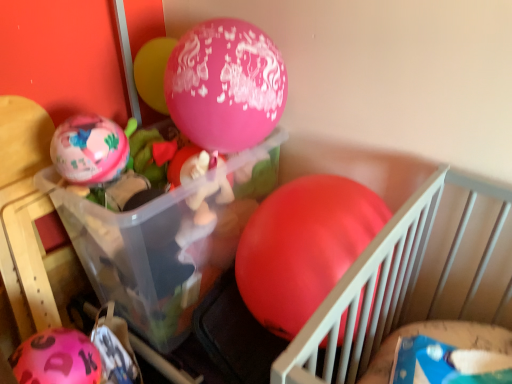
This screenshot has height=384, width=512. Describe the element at coordinates (57, 358) in the screenshot. I see `pink matte balloon at lower left, the fourth balloon from the right` at that location.

You are a GUI agent. You are given a task and a screenshot of the screen. Output one action in this format:
    pyautogui.click(x=<x>, y=<y>)
    Task: Click on the pink matte balloon at lower left, the fourth balloon from the right
    The image size is (512, 384).
    Given the screenshot: What is the action you would take?
    pyautogui.click(x=57, y=358)

Measure the distance between point (113, 232) and camera.

The depth of point (113, 232) is 38.35 inches.

What do you see at coordinates (167, 239) in the screenshot?
I see `transparent plastic container at center` at bounding box center [167, 239].

The height and width of the screenshot is (384, 512). In order to click on pink matte balloon at lower left, the fourth balloon from the right in this screenshot , I will do `click(57, 358)`.

Is transparent plastic container at center bigger than rubber matte balloon at center, positioned as the 4th balloon in left-to-right order?

Yes, transparent plastic container at center is bigger than rubber matte balloon at center, positioned as the 4th balloon in left-to-right order.

From a real-world perspective, which is physically above, transparent plastic container at center or rubber matte balloon at center, positioned as the 4th balloon in left-to-right order?

From a 3D spatial view, rubber matte balloon at center, positioned as the 4th balloon in left-to-right order, is above.

Is transparent plastic container at center not inside rubber matte balloon at center, which is the first balloon in right-to-left order?

That's correct, transparent plastic container at center is outside of rubber matte balloon at center, which is the first balloon in right-to-left order.

Is transparent plastic container at center far away from rubber matte balloon at center, positioned as the 4th balloon in left-to-right order?

transparent plastic container at center is near rubber matte balloon at center, positioned as the 4th balloon in left-to-right order, not far away.

Would you say rubber matte balloon at center, positioned as the 4th balloon in left-to-right order, is inside or outside pink glossy balloon at upper center, marked as the third balloon in a left-to-right arrangement?

rubber matte balloon at center, positioned as the 4th balloon in left-to-right order, is not inside pink glossy balloon at upper center, marked as the third balloon in a left-to-right arrangement, it's outside.

Is the depth of rubber matte balloon at center, positioned as the 4th balloon in left-to-right order, greater than that of pink glossy balloon at upper center, the 2th balloon in the right-to-left sequence?

No, it is in front of pink glossy balloon at upper center, the 2th balloon in the right-to-left sequence.

Which of these two, rubber matte balloon at center, positioned as the 4th balloon in left-to-right order, or pink glossy balloon at upper center, marked as the third balloon in a left-to-right arrangement, is thinner?

With smaller width is pink glossy balloon at upper center, marked as the third balloon in a left-to-right arrangement.

Does point (317, 262) come farther from viewer compared to point (150, 87)?

No, (317, 262) is in front of (150, 87).

Can you tell me how much pink glossy balloon at upper center, marked as the third balloon in a left-to-right arrangement, and matte pink balloon at left, placed as the second balloon when sorted from left to right, differ in facing direction?

They differ by 18.8 degrees in their facing directions.

Is pink glossy balloon at upper center, the 2th balloon in the right-to-left sequence, taller than matte pink balloon at left, placed as the second balloon when sorted from left to right?

Indeed, pink glossy balloon at upper center, the 2th balloon in the right-to-left sequence, has a greater height compared to matte pink balloon at left, placed as the second balloon when sorted from left to right.

Measure the distance from pink glossy balloon at upper center, the 2th balloon in the right-to-left sequence, to matte pink balloon at left, which is the third balloon from right to left.

They are 10.51 inches apart.

Would you say pink glossy balloon at upper center, the 2th balloon in the right-to-left sequence, is outside matte pink balloon at left, placed as the second balloon when sorted from left to right?

Yes, pink glossy balloon at upper center, the 2th balloon in the right-to-left sequence, is not within matte pink balloon at left, placed as the second balloon when sorted from left to right.

From a real-world perspective, is pink glossy balloon at upper center, the 2th balloon in the right-to-left sequence, above or below pink matte balloon at lower left, the 1th balloon positioned from the left?

pink glossy balloon at upper center, the 2th balloon in the right-to-left sequence, is situated higher than pink matte balloon at lower left, the 1th balloon positioned from the left, in the real world.

Between pink glossy balloon at upper center, marked as the third balloon in a left-to-right arrangement, and pink matte balloon at lower left, the 1th balloon positioned from the left, which one is positioned in front?

pink matte balloon at lower left, the 1th balloon positioned from the left, is more forward.

What are the coordinates of `balloon that is the 2nd object located in front of the pink glossy balloon at upper center, the 2th balloon in the right-to-left sequence` in the screenshot? It's located at (57, 358).

Does point (288, 256) come in front of point (58, 149)?

Yes, point (288, 256) is closer to viewer.

Is rubber matte balloon at center, positioned as the 4th balloon in left-to-right order, positioned with its back to matte pink balloon at left, which is the third balloon from right to left?

No, rubber matte balloon at center, positioned as the 4th balloon in left-to-right order, is not facing away from matte pink balloon at left, which is the third balloon from right to left.

From a real-world perspective, which object rests below the other?

rubber matte balloon at center, positioned as the 4th balloon in left-to-right order, is physically lower.

Is the position of rubber matte balloon at center, which is the first balloon in right-to-left order, less distant than that of matte pink balloon at left, placed as the second balloon when sorted from left to right?

Yes, rubber matte balloon at center, which is the first balloon in right-to-left order, is closer to the viewer.

Is point (99, 172) closer or farther from the camera than point (163, 50)?

Clearly, point (99, 172) is closer to the camera than point (163, 50).

From the image's perspective, which is above, matte pink balloon at left, placed as the second balloon when sorted from left to right, or pink glossy balloon at upper center, marked as the third balloon in a left-to-right arrangement?

Answer: From the image's view, pink glossy balloon at upper center, marked as the third balloon in a left-to-right arrangement, is above.

Would you say matte pink balloon at left, placed as the second balloon when sorted from left to right, is a long distance from pink glossy balloon at upper center, marked as the third balloon in a left-to-right arrangement?

No, matte pink balloon at left, placed as the second balloon when sorted from left to right, is not far from pink glossy balloon at upper center, marked as the third balloon in a left-to-right arrangement.

How many degrees apart are the facing directions of matte pink balloon at left, which is the third balloon from right to left, and pink glossy balloon at upper center, marked as the third balloon in a left-to-right arrangement?

There is a 18.8-degree angle between the facing directions of matte pink balloon at left, which is the third balloon from right to left, and pink glossy balloon at upper center, marked as the third balloon in a left-to-right arrangement.

Is pink glossy balloon at upper center, the 2th balloon in the right-to-left sequence, far from transparent plastic container at center?

Actually, pink glossy balloon at upper center, the 2th balloon in the right-to-left sequence, and transparent plastic container at center are a little close together.

Is transparent plastic container at center at the back of pink glossy balloon at upper center, the 2th balloon in the right-to-left sequence?

No, pink glossy balloon at upper center, the 2th balloon in the right-to-left sequence, is not facing away from transparent plastic container at center.

From a real-world perspective, who is located higher, pink glossy balloon at upper center, the 2th balloon in the right-to-left sequence, or transparent plastic container at center?

pink glossy balloon at upper center, the 2th balloon in the right-to-left sequence.

Locate an element on the screen. This screenshot has width=512, height=384. storage box below the rubber matte balloon at center, positioned as the 4th balloon in left-to-right order (from a real-world perspective) is located at coordinates (167, 239).

Where is `balloon that is the 2nd one when counting upward from the rubber matte balloon at center, which is the first balloon in right-to-left order (from the image's perspective)`? balloon that is the 2nd one when counting upward from the rubber matte balloon at center, which is the first balloon in right-to-left order (from the image's perspective) is located at coordinates (153, 71).

Looking at the image, which one is located closer to rubber matte balloon at center, which is the first balloon in right-to-left order, pink matte balloon at lower left, the fourth balloon from the right, or pink glossy balloon at upper center, the 2th balloon in the right-to-left sequence?

pink matte balloon at lower left, the fourth balloon from the right, lies closer to rubber matte balloon at center, which is the first balloon in right-to-left order, than the other object.

Based on their spatial positions, is rubber matte balloon at center, positioned as the 4th balloon in left-to-right order, or transparent plastic container at center closer to matte pink balloon at left, placed as the second balloon when sorted from left to right?

The object closer to matte pink balloon at left, placed as the second balloon when sorted from left to right, is transparent plastic container at center.

Based on their spatial positions, is transparent plastic container at center or matte pink balloon at left, which is the third balloon from right to left, closer to rubber matte balloon at center, positioned as the 4th balloon in left-to-right order?

Among the two, transparent plastic container at center is located nearer to rubber matte balloon at center, positioned as the 4th balloon in left-to-right order.

Considering their positions, is transparent plastic container at center positioned closer to matte pink balloon at left, placed as the second balloon when sorted from left to right, than rubber matte balloon at center, positioned as the 4th balloon in left-to-right order?

transparent plastic container at center is positioned closer to the anchor matte pink balloon at left, placed as the second balloon when sorted from left to right.

Which object lies further to the anchor point matte pink balloon at left, which is the third balloon from right to left, pink matte balloon at lower left, the fourth balloon from the right, or pink glossy balloon at upper center, the 2th balloon in the right-to-left sequence?

pink matte balloon at lower left, the fourth balloon from the right, lies further to matte pink balloon at left, which is the third balloon from right to left, than the other object.

Looking at the image, which one is located further to matte pink balloon at left, placed as the second balloon when sorted from left to right, pink glossy balloon at upper center, marked as the third balloon in a left-to-right arrangement, or transparent plastic container at center?

pink glossy balloon at upper center, marked as the third balloon in a left-to-right arrangement.

Which object lies further to the anchor point transparent plastic container at center, matte pink balloon at left, placed as the second balloon when sorted from left to right, or pink matte balloon at lower left, the 1th balloon positioned from the left?

pink matte balloon at lower left, the 1th balloon positioned from the left, is further to transparent plastic container at center.

Looking at the image, which one is located further to rubber matte balloon at center, positioned as the 4th balloon in left-to-right order, transparent plastic container at center or pink matte balloon at lower left, the 1th balloon positioned from the left?

pink matte balloon at lower left, the 1th balloon positioned from the left, is further to rubber matte balloon at center, positioned as the 4th balloon in left-to-right order.

Where is `storage box located between pink matte balloon at lower left, the fourth balloon from the right, and rubber matte balloon at center, positioned as the 4th balloon in left-to-right order, in the left-right direction`? The width and height of the screenshot is (512, 384). storage box located between pink matte balloon at lower left, the fourth balloon from the right, and rubber matte balloon at center, positioned as the 4th balloon in left-to-right order, in the left-right direction is located at coordinates (167, 239).

Where is `storage box between matte pink balloon at left, placed as the second balloon when sorted from left to right, and rubber matte balloon at center, positioned as the 4th balloon in left-to-right order`? The image size is (512, 384). storage box between matte pink balloon at left, placed as the second balloon when sorted from left to right, and rubber matte balloon at center, positioned as the 4th balloon in left-to-right order is located at coordinates (167, 239).

The height and width of the screenshot is (384, 512). I want to click on balloon between matte pink balloon at left, placed as the second balloon when sorted from left to right, and rubber matte balloon at center, positioned as the 4th balloon in left-to-right order, from left to right, so click(153, 71).

The image size is (512, 384). What are the coordinates of `balloon between pink glossy balloon at upper center, marked as the third balloon in a left-to-right arrangement, and transparent plastic container at center from top to bottom` in the screenshot? It's located at (89, 149).